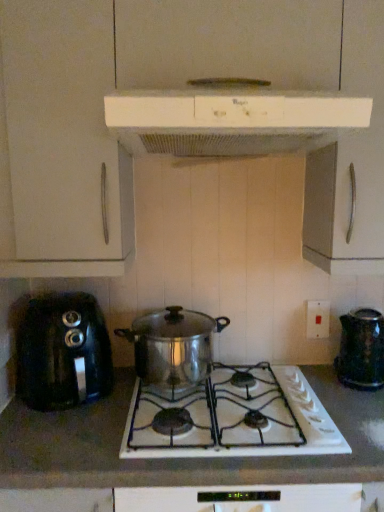
This screenshot has width=384, height=512. Find the location of `free point in front of black plastic toaster at left, the second kitchen appliance positioned from the bottom`. free point in front of black plastic toaster at left, the second kitchen appliance positioned from the bottom is located at coordinates (56, 440).